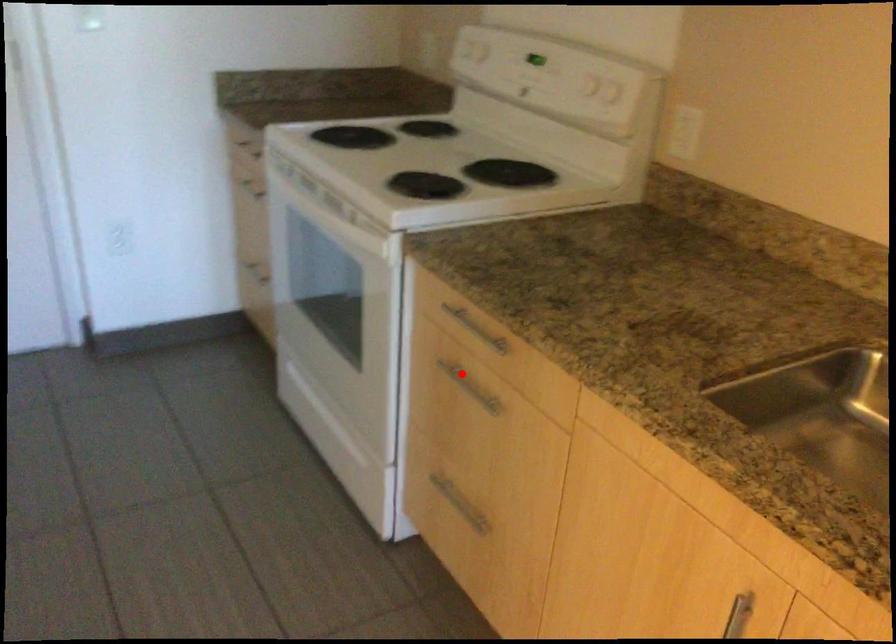
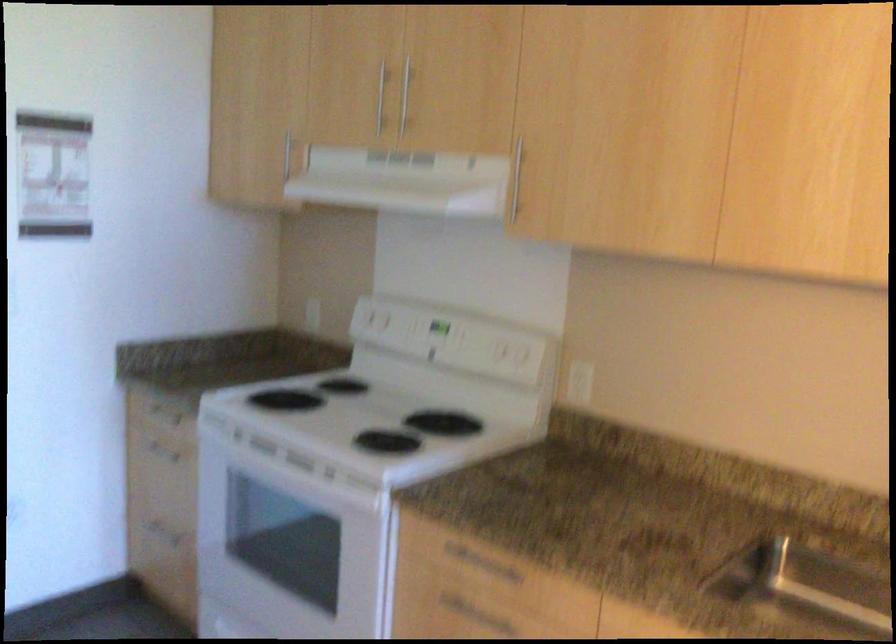
Question: I am providing you with two images of the same scene from different viewpoints. In image1, a red point is highlighted. Considering the same 3D point in image2, which of the following is correct?

Choices:
 (A) It is closer
 (B) It is farther

Answer: (B)